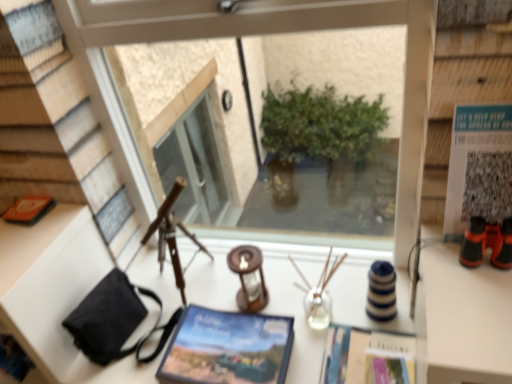
What are the coordinates of `vacant space to the right of orange matte book at left` in the screenshot? It's located at coord(59,213).